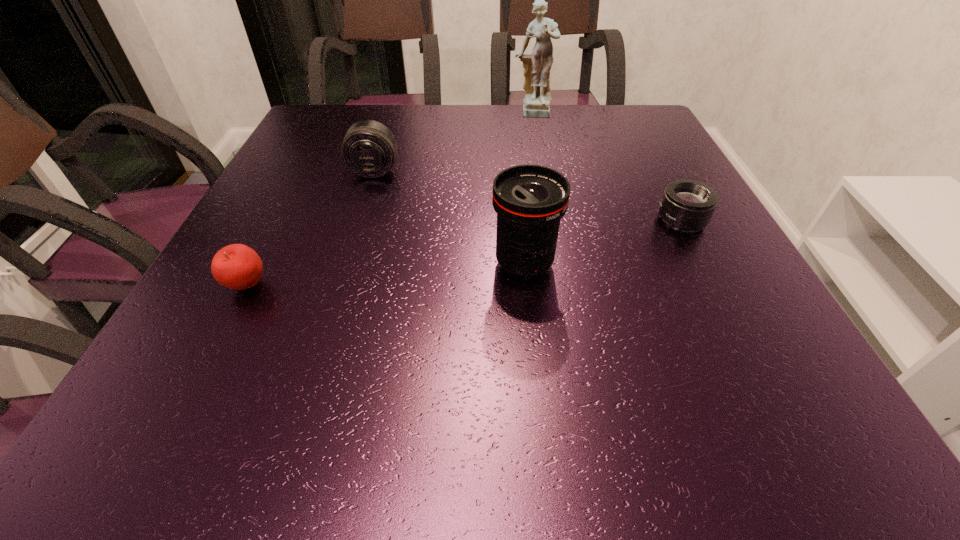
Where is `vacant space located on the front-facing side of the tallest object`? The image size is (960, 540). vacant space located on the front-facing side of the tallest object is located at coordinates (540, 161).

You are a GUI agent. You are given a task and a screenshot of the screen. Output one action in this format:
    pyautogui.click(x=<x>, y=<y>)
    Task: Click on the free space located on the back of the second tallest object
    
    Given the screenshot: What is the action you would take?
    pyautogui.click(x=518, y=209)

Find the location of a particular element. free space located on the front-facing side of the fourth nearest object is located at coordinates [x=344, y=269].

Where is `vacant space located on the right of the apple`? The width and height of the screenshot is (960, 540). vacant space located on the right of the apple is located at coordinates (325, 286).

Where is `free space located 0.390m on the side of the shortest object with brand markings and control switches`? This screenshot has width=960, height=540. free space located 0.390m on the side of the shortest object with brand markings and control switches is located at coordinates (468, 220).

Locate an element on the screen. The height and width of the screenshot is (540, 960). free space located on the side of the shortest object with brand markings and control switches is located at coordinates (569, 220).

Identify the location of free space located 0.150m on the side of the shortest object with brand markings and control switches. (584, 220).

Where is `object that is positioned at the far edge`? This screenshot has width=960, height=540. object that is positioned at the far edge is located at coordinates (537, 65).

Locate an element on the screen. The image size is (960, 540). object that is at the left edge is located at coordinates (236, 266).

Find the location of a particular element. This screenshot has height=540, width=960. object positioned at the right edge is located at coordinates (687, 205).